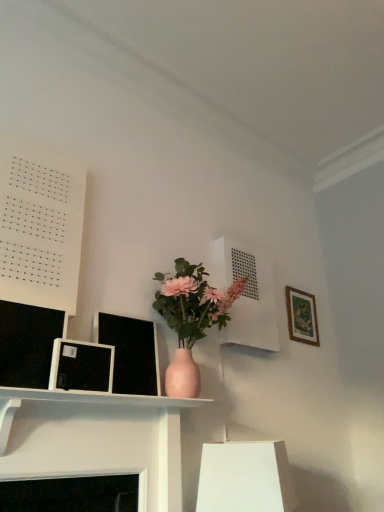
Question: Considering the relative positions of wooden picture frame at upper right, the first picture frame positioned from the right, and white paper at upper left in the image provided, is wooden picture frame at upper right, the first picture frame positioned from the right, to the left or to the right of white paper at upper left?

Choices:
 (A) left
 (B) right

Answer: (B)

Question: Which is correct: wooden picture frame at upper right, the second picture frame from the left, is inside white paper at upper left, or outside of it?

Choices:
 (A) outside
 (B) inside

Answer: (A)

Question: Estimate the real-world distances between objects in this image. Which object is farther from the matte black picture frame at left, placed as the first picture frame when sorted from left to right?

Choices:
 (A) wooden picture frame at upper right, the first picture frame positioned from the right
 (B) white matte vent at upper center, which is the first shelf in right-to-left order
 (C) white paper at upper left
 (D) matte white shelf at center, the first shelf in the left-to-right sequence

Answer: (A)

Question: Based on their relative distances, which object is nearer to the white matte vent at upper center, which is the first shelf in right-to-left order?

Choices:
 (A) white paper at upper left
 (B) matte black picture frame at left, which ranks as the 1th picture frame in front-to-back order
 (C) wooden picture frame at upper right, the first picture frame positioned from the right
 (D) matte white shelf at center, arranged as the second shelf when viewed from the right

Answer: (C)